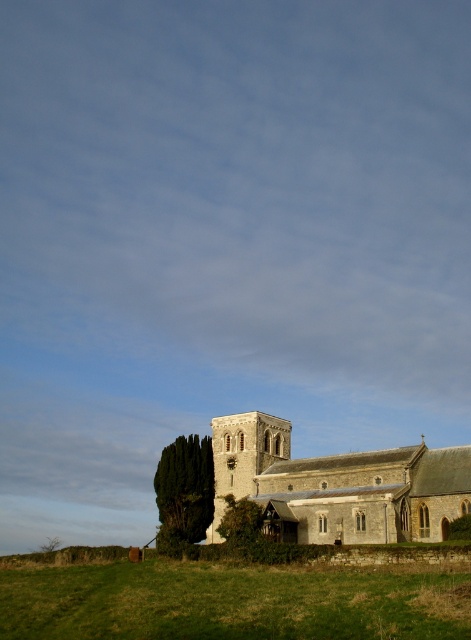
Question: From the image, what is the correct spatial relationship of stone church at center in relation to green textured tree at lower left?

Choices:
 (A) left
 (B) right

Answer: (B)

Question: Estimate the real-world distances between objects in this image. Which object is farther from the green grassy field at lower center?

Choices:
 (A) stone church at center
 (B) green textured tree at lower left

Answer: (A)

Question: Does stone church at center come in front of green textured tree at lower left?

Choices:
 (A) no
 (B) yes

Answer: (B)

Question: Can you confirm if stone church at center is positioned to the right of green textured tree at lower left?

Choices:
 (A) yes
 (B) no

Answer: (A)

Question: Based on their relative distances, which object is nearer to the stone church at center?

Choices:
 (A) green textured tree at lower left
 (B) green grassy field at lower center

Answer: (A)

Question: Which point is closer to the camera?

Choices:
 (A) stone church at center
 (B) green grassy field at lower center
 (C) green textured tree at lower left

Answer: (B)